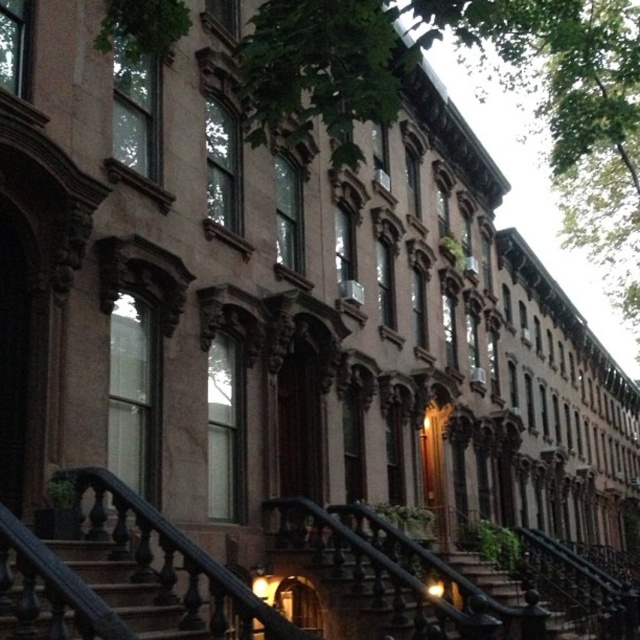
Question: Which of the following is the closest to the observer?

Choices:
 (A) (109, 560)
 (B) (502, 577)

Answer: (A)

Question: Does dark brown wood stairs at lower left lie in front of black wrought iron stairs at center?

Choices:
 (A) yes
 (B) no

Answer: (A)

Question: Can you confirm if dark brown wood stairs at lower left is positioned above black wrought iron stairs at center?

Choices:
 (A) no
 (B) yes

Answer: (B)

Question: Is dark brown wood stairs at lower left thinner than black wrought iron stairs at center?

Choices:
 (A) yes
 (B) no

Answer: (A)

Question: Which point is farther from the camera taking this photo?

Choices:
 (A) [77, 572]
 (B) [502, 589]

Answer: (B)